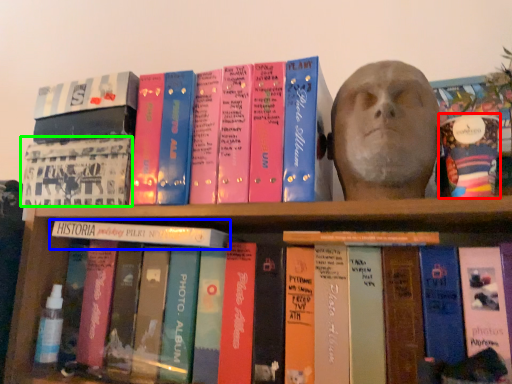
Question: Which object is the closest to the paperback book (highlighted by a red box)? Choose among these: book (highlighted by a blue box) or book cover (highlighted by a green box).

Choices:
 (A) book
 (B) book cover

Answer: (A)